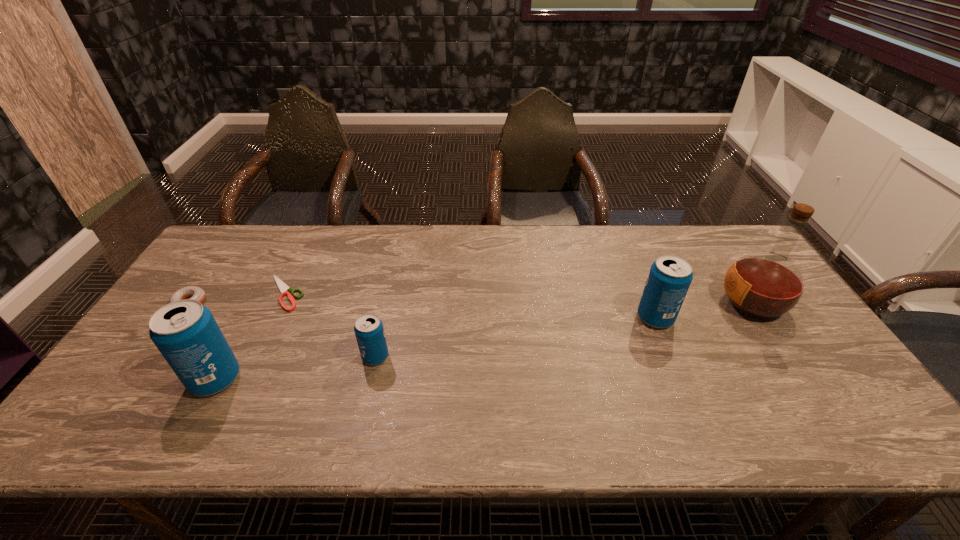
This screenshot has height=540, width=960. I want to click on vacant space situated 0.090m on the left of the leftmost soda can, so click(155, 379).

I want to click on vacant space located 0.380m on the back of the third object from right to left, so click(398, 256).

Where is `free space located 0.120m on the front of the rightmost soda can`? The image size is (960, 540). free space located 0.120m on the front of the rightmost soda can is located at coordinates (676, 367).

Find the location of a particular element. The image size is (960, 540). vacant space positioned 0.160m on the front label of the liquor is located at coordinates (664, 303).

The height and width of the screenshot is (540, 960). In order to click on free space located 0.070m on the front label of the liquor in this screenshot , I will do `click(695, 303)`.

Locate an element on the screen. Image resolution: width=960 pixels, height=540 pixels. blank space located on the front label of the liquor is located at coordinates (612, 303).

Where is `vacant space situated on the left of the scissors`? vacant space situated on the left of the scissors is located at coordinates (214, 292).

Find the location of a particular element. The width and height of the screenshot is (960, 540). blank space located on the back of the leftmost object is located at coordinates (223, 256).

Find the location of `object at the near edge`. object at the near edge is located at coordinates (185, 332).

This screenshot has width=960, height=540. Identify the location of object that is at the left edge. (196, 293).